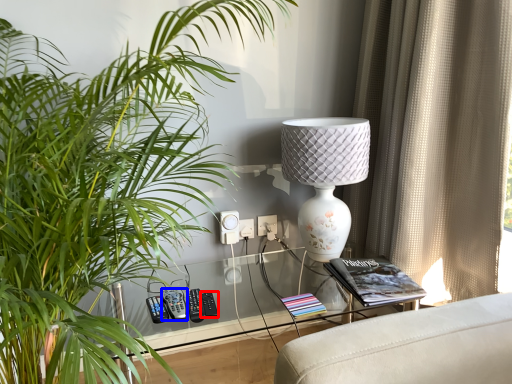
Question: Which object appears closest to the camera in this image, control (highlighted by a red box) or control (highlighted by a blue box)?

Choices:
 (A) control
 (B) control

Answer: (B)